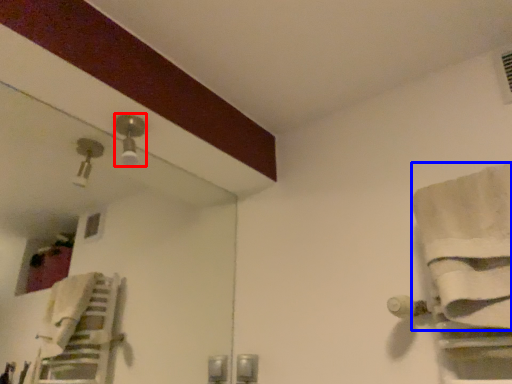
Question: Which object is further to the camera taking this photo, light fixture (highlighted by a red box) or bath towel (highlighted by a blue box)?

Choices:
 (A) light fixture
 (B) bath towel

Answer: (A)